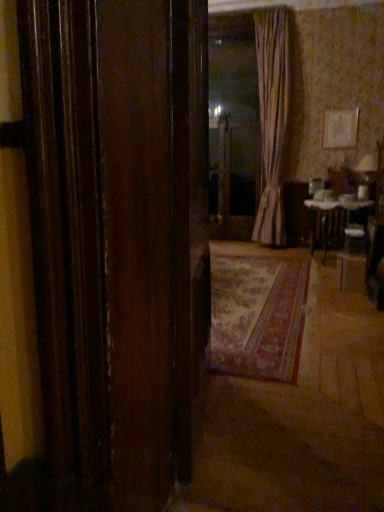
Question: Relative to striped fabric curtain at center, is white glossy table at center in front or behind?

Choices:
 (A) behind
 (B) front

Answer: (B)

Question: From a real-world perspective, is white glossy table at center physically located above or below striped fabric curtain at center?

Choices:
 (A) below
 (B) above

Answer: (A)

Question: Considering the real-world distances, which object is closest to the white glossy table at center?

Choices:
 (A) transparent glass door at center
 (B) wooden door at center
 (C) striped fabric curtain at center

Answer: (C)

Question: Which object is the farthest from the striped fabric curtain at center?

Choices:
 (A) white glossy table at center
 (B) transparent glass door at center
 (C) wooden door at center

Answer: (C)